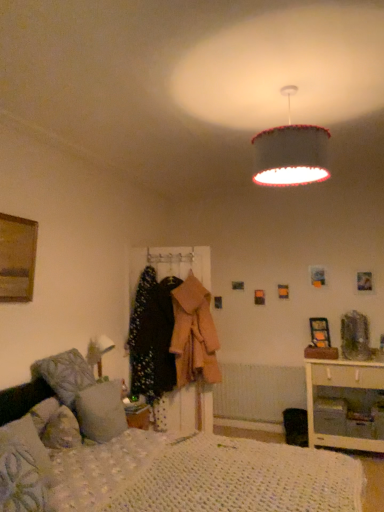
Where is `fluffy gray pillow at lower left, arranged as the second pillow when viewed from the front`? fluffy gray pillow at lower left, arranged as the second pillow when viewed from the front is located at coordinates (101, 411).

I want to click on white knitted mattress at lower center, so click(x=242, y=479).

Describe the element at coordinates (24, 469) in the screenshot. This screenshot has height=512, width=384. I see `fluffy white pillow at lower left, which is the 2th pillow from back to front` at that location.

What do you see at coordinates (152, 336) in the screenshot? I see `floral fabric coat at center, placed as the first clothing when sorted from left to right` at bounding box center [152, 336].

At what (x,y) coordinates should I click in order to perform the action: click on light pink wool coat at center, which is the first clothing from right to left. Please return your answer as a coordinate pair (x, y). The width and height of the screenshot is (384, 512). Looking at the image, I should click on (194, 334).

Identify the location of white wood nightstand at lower right. (344, 387).

This screenshot has height=512, width=384. Describe the element at coordinates (17, 258) in the screenshot. I see `wooden picture frame at left, which is the first picture frame in top-to-bottom order` at that location.

Locate an element on the screen. This screenshot has width=384, height=512. fluffy gray pillow at lower left, positioned as the 1th pillow in back-to-front order is located at coordinates (101, 411).

Does wooden picture frame at left, marked as the second picture frame in a right-to-left arrangement, have a greater height compared to white knitted bed at lower left?

No, wooden picture frame at left, marked as the second picture frame in a right-to-left arrangement, is not taller than white knitted bed at lower left.

In the scene shown: Which object is further away from the camera, wooden picture frame at left, marked as the second picture frame in a right-to-left arrangement, or white knitted bed at lower left?

wooden picture frame at left, marked as the second picture frame in a right-to-left arrangement.

Considering the sizes of wooden picture frame at left, the 2th picture frame from the bottom, and white knitted bed at lower left in the image, is wooden picture frame at left, the 2th picture frame from the bottom, bigger or smaller than white knitted bed at lower left?

Considering their sizes, wooden picture frame at left, the 2th picture frame from the bottom, takes up less space than white knitted bed at lower left.

Looking at this image, is wooden picture frame at left, placed as the 1th picture frame when sorted from front to back, to the right of white knitted bed at lower left from the viewer's perspective?

Incorrect, wooden picture frame at left, placed as the 1th picture frame when sorted from front to back, is not on the right side of white knitted bed at lower left.

Does white knitted mattress at lower center have a greater width compared to fluffy white pillow at lower left, which is the 2th pillow from back to front?

Indeed, white knitted mattress at lower center has a greater width compared to fluffy white pillow at lower left, which is the 2th pillow from back to front.

Considering the relative sizes of white knitted mattress at lower center and fluffy white pillow at lower left, which is counted as the first pillow, starting from the front, in the image provided, is white knitted mattress at lower center smaller than fluffy white pillow at lower left, which is counted as the first pillow, starting from the front,?

Incorrect, white knitted mattress at lower center is not smaller in size than fluffy white pillow at lower left, which is counted as the first pillow, starting from the front.

Is the position of white knitted mattress at lower center less distant than that of fluffy white pillow at lower left, which is counted as the first pillow, starting from the front?

That is True.

From the image's perspective, would you say white knitted mattress at lower center is shown under fluffy white pillow at lower left, which is the 2th pillow from back to front?

Correct, white knitted mattress at lower center appears lower than fluffy white pillow at lower left, which is the 2th pillow from back to front, in the image.

The width and height of the screenshot is (384, 512). I want to click on bed that appears below the light pink wool coat at center, arranged as the second clothing when viewed from the left (from the image's perspective), so click(x=172, y=475).

From the image's perspective, between light pink wool coat at center, arranged as the second clothing when viewed from the left, and white knitted bed at lower left, which one is located above?

light pink wool coat at center, arranged as the second clothing when viewed from the left, is shown above in the image.

How many degrees apart are the facing directions of light pink wool coat at center, arranged as the second clothing when viewed from the left, and white knitted bed at lower left?

73 degrees separate the facing orientations of light pink wool coat at center, arranged as the second clothing when viewed from the left, and white knitted bed at lower left.

Is white knitted bed at lower left located within light pink wool coat at center, which is the first clothing from right to left?

No, white knitted bed at lower left is not inside light pink wool coat at center, which is the first clothing from right to left.

Does point (32, 423) come closer to viewer compared to point (325, 487)?

No, it is not.

Considering the positions of objects white knitted bed at lower left and white knitted mattress at lower center in the image provided, who is behind, white knitted bed at lower left or white knitted mattress at lower center?

Positioned behind is white knitted mattress at lower center.

Is white knitted bed at lower left smaller than white knitted mattress at lower center?

No.

This screenshot has height=512, width=384. I want to click on bed in front of the white knitted mattress at lower center, so pyautogui.click(x=172, y=475).

In the scene shown: Can you tell me how much fluffy white pillow at lower left, which is counted as the first pillow, starting from the front, and textured fabric lampshade at upper center differ in facing direction?

The angle between the facing direction of fluffy white pillow at lower left, which is counted as the first pillow, starting from the front, and the facing direction of textured fabric lampshade at upper center is 8.16 degrees.

Considering the relative positions of fluffy white pillow at lower left, which is counted as the first pillow, starting from the front, and textured fabric lampshade at upper center in the image provided, is fluffy white pillow at lower left, which is counted as the first pillow, starting from the front, to the right of textured fabric lampshade at upper center from the viewer's perspective?

No.

Where is `pillow in front of the textured fabric lampshade at upper center`? The width and height of the screenshot is (384, 512). pillow in front of the textured fabric lampshade at upper center is located at coordinates (24, 469).

Looking at their sizes, would you say fluffy white pillow at lower left, which is counted as the first pillow, starting from the front, is wider or thinner than textured fabric lampshade at upper center?

fluffy white pillow at lower left, which is counted as the first pillow, starting from the front, is thinner than textured fabric lampshade at upper center.

Could you tell me if fluffy gray pillow at lower left, positioned as the 1th pillow in back-to-front order, is facing floral fabric coat at center, which is the 2th clothing in right-to-left order?

No, fluffy gray pillow at lower left, positioned as the 1th pillow in back-to-front order, is not turned towards floral fabric coat at center, which is the 2th clothing in right-to-left order.

Based on the photo, is floral fabric coat at center, which is the 2th clothing in right-to-left order, inside fluffy gray pillow at lower left, arranged as the second pillow when viewed from the front?

Definitely not — floral fabric coat at center, which is the 2th clothing in right-to-left order, is not inside fluffy gray pillow at lower left, arranged as the second pillow when viewed from the front.

From the image's perspective, is fluffy gray pillow at lower left, positioned as the 1th pillow in back-to-front order, positioned above or below floral fabric coat at center, which is the 2th clothing in right-to-left order?

Clearly, from the image's perspective, fluffy gray pillow at lower left, positioned as the 1th pillow in back-to-front order, is below floral fabric coat at center, which is the 2th clothing in right-to-left order.

Is the position of fluffy gray pillow at lower left, arranged as the second pillow when viewed from the front, more distant than that of floral fabric coat at center, placed as the first clothing when sorted from left to right?

No, fluffy gray pillow at lower left, arranged as the second pillow when viewed from the front, is in front of floral fabric coat at center, placed as the first clothing when sorted from left to right.

In the image, is white knitted bed at lower left positioned in front of or behind textured fabric lampshade at upper center?

Visually, white knitted bed at lower left is located in front of textured fabric lampshade at upper center.

Considering the points (172, 443) and (296, 136), which point is in front, point (172, 443) or point (296, 136)?

Positioned in front is point (296, 136).

From the picture: How different are the orientations of white knitted bed at lower left and textured fabric lampshade at upper center in degrees?

The angle between the facing direction of white knitted bed at lower left and the facing direction of textured fabric lampshade at upper center is 2.71 degrees.

Is white knitted bed at lower left not close to textured fabric lampshade at upper center?

Yes, white knitted bed at lower left and textured fabric lampshade at upper center are located far from each other.

Identify the location of bed that appears below the wooden picture frame at left, marked as the second picture frame in a right-to-left arrangement (from a real-world perspective). (172, 475).

You are a GUI agent. You are given a task and a screenshot of the screen. Output one action in this format:
    pyautogui.click(x=<x>, y=<y>)
    Task: Click on the mattress located below the fluffy white pillow at lower left, which is the 2th pillow from back to front (from the image's perspective)
    This screenshot has height=512, width=384.
    Given the screenshot: What is the action you would take?
    tap(242, 479)

When comparing their distances from white knitted bed at lower left, does fluffy gray pillow at lower left, arranged as the second pillow when viewed from the front, or white knitted mattress at lower center seem further?

The object further to white knitted bed at lower left is fluffy gray pillow at lower left, arranged as the second pillow when viewed from the front.

When comparing their distances from wooden picture frame at right, the 2th picture frame in the left-to-right sequence, does wooden picture frame at left, marked as the second picture frame in a right-to-left arrangement, or white knitted bed at lower left seem closer?

Based on the image, white knitted bed at lower left appears to be nearer to wooden picture frame at right, the 2th picture frame in the left-to-right sequence.

Which object lies nearer to the anchor point fluffy gray pillow at lower left, positioned as the 1th pillow in back-to-front order, wooden picture frame at left, placed as the first picture frame when sorted from left to right, or textured fabric lampshade at upper center?

Based on the image, wooden picture frame at left, placed as the first picture frame when sorted from left to right, appears to be nearer to fluffy gray pillow at lower left, positioned as the 1th pillow in back-to-front order.

Based on their spatial positions, is light pink wool coat at center, arranged as the second clothing when viewed from the left, or white wood nightstand at lower right closer to fluffy white pillow at lower left, which is the 2th pillow from back to front?

light pink wool coat at center, arranged as the second clothing when viewed from the left, is positioned closer to the anchor fluffy white pillow at lower left, which is the 2th pillow from back to front.

Based on the photo, from the image, which object appears to be nearer to fluffy white pillow at lower left, which is counted as the first pillow, starting from the front, floral fabric coat at center, which is the 2th clothing in right-to-left order, or white knitted mattress at lower center?

The object closer to fluffy white pillow at lower left, which is counted as the first pillow, starting from the front, is white knitted mattress at lower center.

From the image, which object appears to be farther from white knitted bed at lower left, fluffy gray pillow at lower left, positioned as the 1th pillow in back-to-front order, or white textured radiator at lower center?

white textured radiator at lower center is positioned further to the anchor white knitted bed at lower left.

Considering their positions, is floral fabric coat at center, placed as the first clothing when sorted from left to right, positioned further to white knitted bed at lower left than textured fabric lampshade at upper center?

textured fabric lampshade at upper center.

Which object lies further to the anchor point white knitted mattress at lower center, textured fabric lampshade at upper center or white wood nightstand at lower right?

The object further to white knitted mattress at lower center is white wood nightstand at lower right.

Image resolution: width=384 pixels, height=512 pixels. In order to click on clothing between fluffy gray pillow at lower left, positioned as the 1th pillow in back-to-front order, and floral fabric coat at center, placed as the first clothing when sorted from left to right, in the front-back direction in this screenshot , I will do `click(194, 334)`.

Locate an element on the screen. Image resolution: width=384 pixels, height=512 pixels. clothing between textured fabric lampshade at upper center and floral fabric coat at center, placed as the first clothing when sorted from left to right, along the z-axis is located at coordinates (194, 334).

You are a GUI agent. You are given a task and a screenshot of the screen. Output one action in this format:
    pyautogui.click(x=<x>, y=<y>)
    Task: Click on the picture frame between fluffy gray pillow at lower left, arranged as the second pillow when viewed from the front, and white textured radiator at lower center from front to back
    
    Given the screenshot: What is the action you would take?
    pyautogui.click(x=320, y=332)

The height and width of the screenshot is (512, 384). Identify the location of nightstand between white knitted mattress at lower center and light pink wool coat at center, arranged as the second clothing when viewed from the left, from front to back. (344, 387).